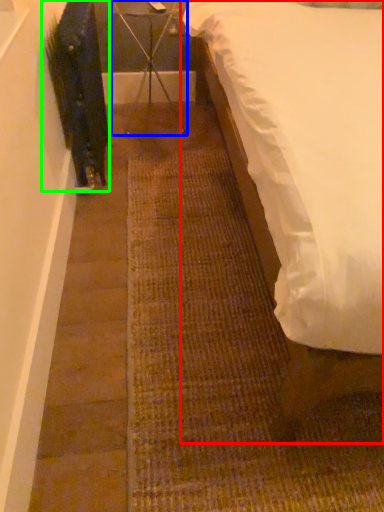
Question: Which is nearer to the bed (highlighted by a red box)? furniture (highlighted by a blue box) or plant (highlighted by a green box).

Choices:
 (A) furniture
 (B) plant

Answer: (B)